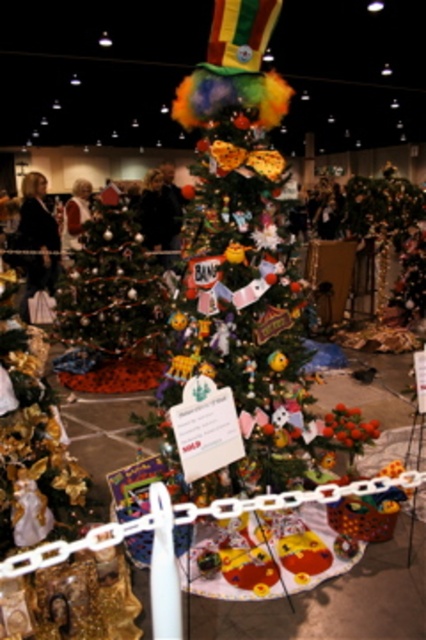
Consider the image. Is green matte christmas tree at left behind matte gold jacket at center?

That is False.

Which is below, green matte christmas tree at left or matte gold jacket at center?

green matte christmas tree at left is lower down.

Find the location of a particular element. This screenshot has height=640, width=426. green matte christmas tree at left is located at coordinates (109, 289).

Image resolution: width=426 pixels, height=640 pixels. I want to click on green matte christmas tree at left, so click(x=109, y=289).

Can you confirm if black fabric at left is positioned to the right of matte gold jacket at center?

No, black fabric at left is not to the right of matte gold jacket at center.

Which is in front, point (43, 196) or point (77, 180)?

Point (43, 196) is in front.

Who is more forward, (52, 221) or (69, 202)?

Point (52, 221) is more forward.

The width and height of the screenshot is (426, 640). I want to click on black fabric at left, so click(x=37, y=241).

Which is more to the right, green matte christmas tree at left or black fabric at left?

green matte christmas tree at left

Is green matte christmas tree at left shorter than black fabric at left?

Yes.

Is point (143, 340) farther from camera compared to point (20, 214)?

No.

At what (x,y) coordinates should I click in order to perform the action: click on green matte christmas tree at left. Please return your answer as a coordinate pair (x, y). Image resolution: width=426 pixels, height=640 pixels. Looking at the image, I should click on (109, 289).